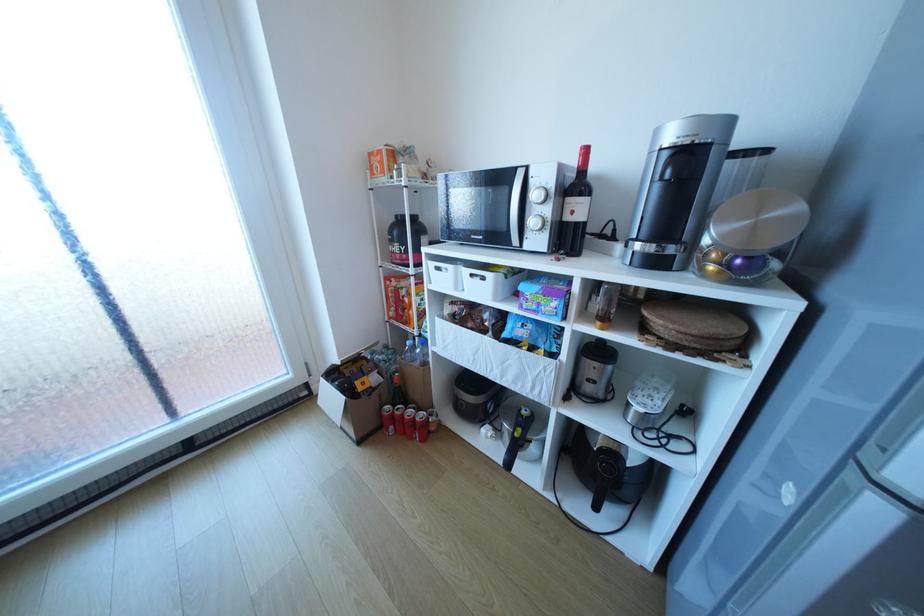
Describe the element at coordinates (513, 446) in the screenshot. I see `a air fryer handle` at that location.